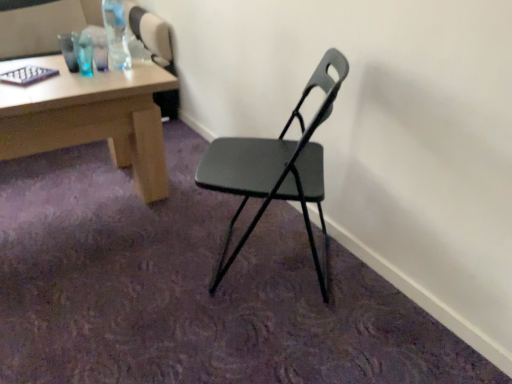
Question: Is matte black chair at center taller than matte wood desk at upper left?

Choices:
 (A) yes
 (B) no

Answer: (A)

Question: Is matte black chair at center positioned far away from matte wood desk at upper left?

Choices:
 (A) no
 (B) yes

Answer: (A)

Question: Is matte black chair at center positioned with its back to matte wood desk at upper left?

Choices:
 (A) no
 (B) yes

Answer: (A)

Question: From the image's perspective, does matte black chair at center appear lower than matte wood desk at upper left?

Choices:
 (A) no
 (B) yes

Answer: (B)

Question: From a real-world perspective, is matte black chair at center over matte wood desk at upper left?

Choices:
 (A) no
 (B) yes

Answer: (B)

Question: From the image's perspective, is matte wood desk at upper left positioned above or below clear plastic bottle at upper left?

Choices:
 (A) below
 (B) above

Answer: (B)

Question: Is matte wood desk at upper left taller or shorter than clear plastic bottle at upper left?

Choices:
 (A) short
 (B) tall

Answer: (B)

Question: Is matte wood desk at upper left wider or thinner than clear plastic bottle at upper left?

Choices:
 (A) thin
 (B) wide

Answer: (B)

Question: In terms of size, does matte wood desk at upper left appear bigger or smaller than clear plastic bottle at upper left?

Choices:
 (A) small
 (B) big

Answer: (B)

Question: Considering their positions, is matte black chair at center located in front of or behind matte wood desk at upper left?

Choices:
 (A) behind
 (B) front

Answer: (B)

Question: Is matte black chair at center situated inside matte wood desk at upper left or outside?

Choices:
 (A) outside
 (B) inside

Answer: (A)

Question: From a real-world perspective, is matte black chair at center physically located above or below matte wood desk at upper left?

Choices:
 (A) above
 (B) below

Answer: (A)

Question: Does point (306, 190) appear closer or farther from the camera than point (137, 99)?

Choices:
 (A) farther
 (B) closer

Answer: (B)

Question: Is point (224, 165) closer or farther from the camera than point (108, 43)?

Choices:
 (A) closer
 (B) farther

Answer: (A)

Question: Considering their positions, is matte black chair at center located in front of or behind clear plastic bottle at upper left?

Choices:
 (A) behind
 (B) front

Answer: (B)